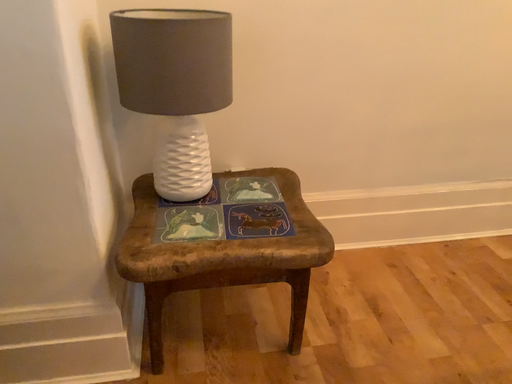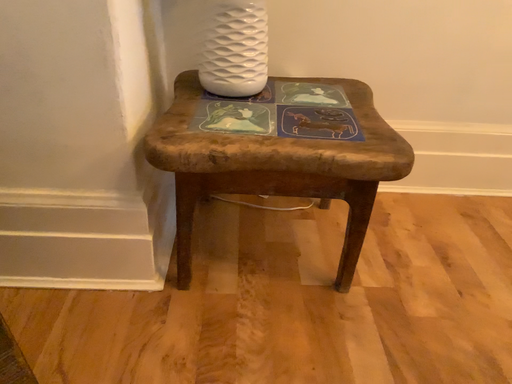
Question: Which way did the camera rotate in the video?

Choices:
 (A) rotated left
 (B) rotated right

Answer: (A)